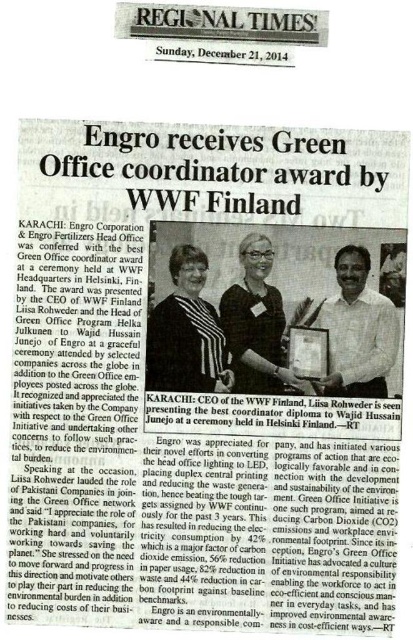
Question: Which is farther from the matte black glasses at center?

Choices:
 (A) black striped dress at center
 (B) white shirt at center

Answer: (B)

Question: Is black striped dress at center below white shirt at center?

Choices:
 (A) no
 (B) yes

Answer: (B)

Question: Is black striped dress at center closer to the viewer compared to matte black glasses at center?

Choices:
 (A) yes
 (B) no

Answer: (A)

Question: Is black striped dress at center below matte black glasses at center?

Choices:
 (A) no
 (B) yes

Answer: (B)

Question: Which point is farther to the camera?

Choices:
 (A) matte black glasses at center
 (B) white shirt at center

Answer: (B)

Question: Which of these objects is positioned farthest from the black striped dress at center?

Choices:
 (A) matte black glasses at center
 (B) white shirt at center

Answer: (B)